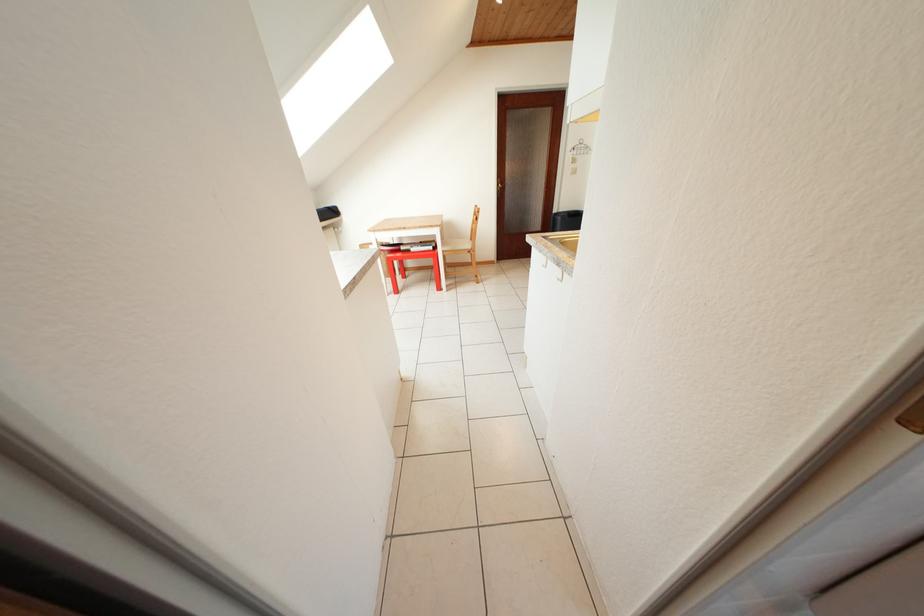
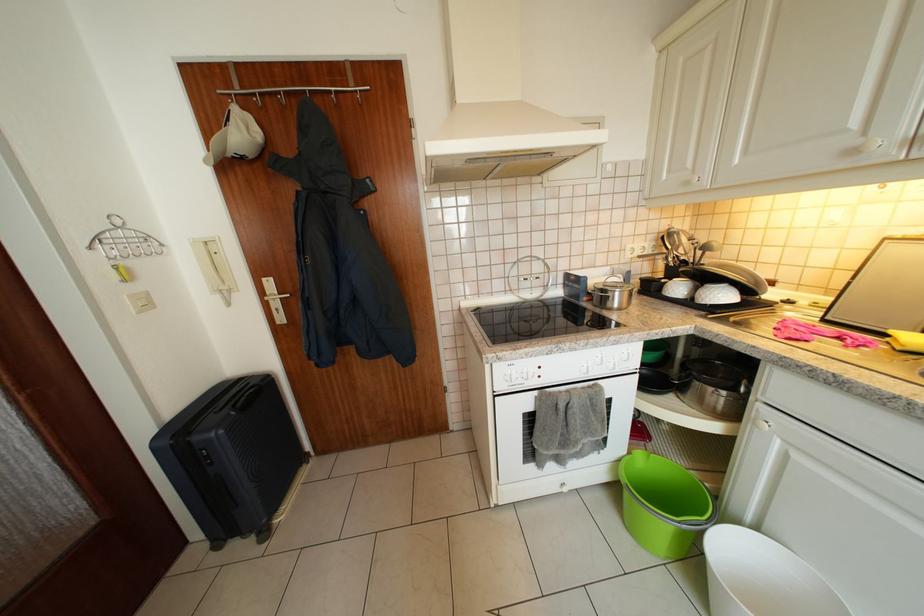
Locate, in the second image, the point that corresponds to (582,171) in the first image.

(144, 293)